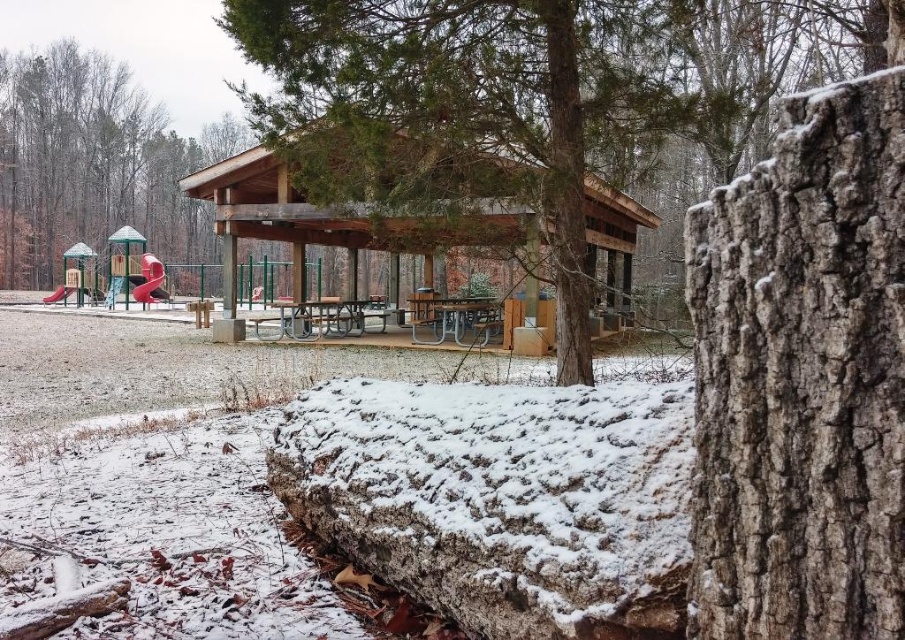
Between wooden picnic shelter at center and metallic red slide at upper left, which one is positioned lower?

Positioned lower is metallic red slide at upper left.

Between point (630, 225) and point (156, 296), which one is positioned in front?

Point (630, 225)

Which is behind, point (246, 180) or point (138, 285)?

Point (138, 285)

In order to click on wooden picnic shelter at center in this screenshot , I will do `click(335, 220)`.

Who is more distant from viewer, (x=405, y=13) or (x=474, y=209)?

The point (x=474, y=209) is more distant.

Consider the image. Is brown rough bark tree at center positioned before wooden picnic shelter at center?

Yes, brown rough bark tree at center is closer to the viewer.

Does point (372, 177) come behind point (517, 314)?

No.

The width and height of the screenshot is (905, 640). What are the coordinates of `brown rough bark tree at center` in the screenshot? It's located at (473, 104).

Which of these two, gray rough bark at center or wooden picnic shelter at center, stands taller?

With more height is wooden picnic shelter at center.

What do you see at coordinates (802, 378) in the screenshot?
I see `gray rough bark at center` at bounding box center [802, 378].

What are the coordinates of `gray rough bark at center` in the screenshot? It's located at (802, 378).